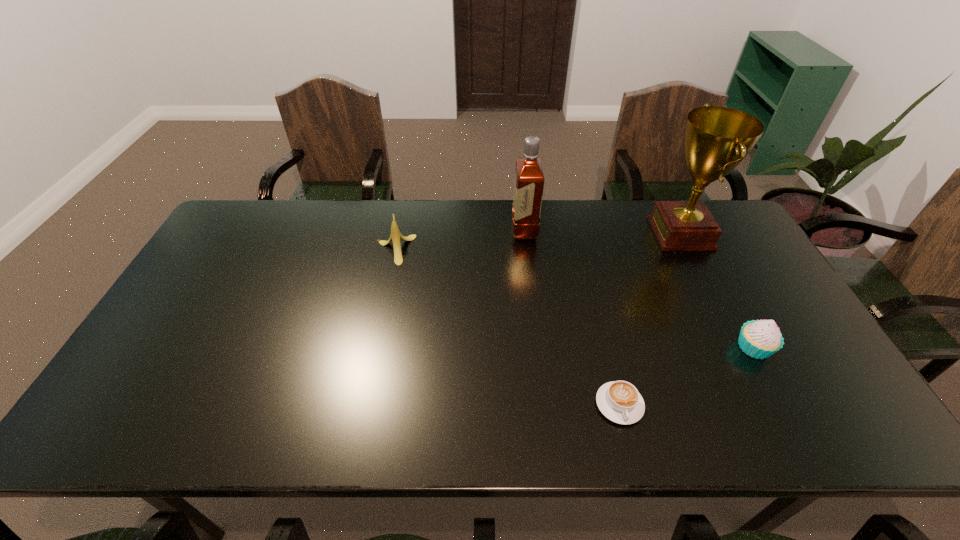
In order to click on blank region between the tallest object and the liquor in this screenshot , I will do `click(603, 231)`.

I want to click on empty location between the leftmost object and the award, so click(538, 241).

Find the location of a particular element. This screenshot has width=960, height=540. free area in between the award and the leftmost object is located at coordinates (538, 241).

Find the location of a particular element. Image resolution: width=960 pixels, height=540 pixels. unoccupied area between the tallest object and the fourth farthest object is located at coordinates (717, 290).

Locate an element on the screen. This screenshot has height=540, width=960. empty location between the nearest object and the leftmost object is located at coordinates [507, 327].

This screenshot has width=960, height=540. What are the coordinates of `free space between the leftmost object and the fourth object from right to left` in the screenshot? It's located at coord(460,240).

Where is `empty location between the fourth shortest object and the award`? empty location between the fourth shortest object and the award is located at coordinates tap(603, 231).

Choose which object is the second nearest neighbor to the tallest object. Please provide its 2D coordinates. Your answer should be formatted as a tuple, i.e. [(x, y)], where the tuple contains the x and y coordinates of a point satisfying the conditions above.

[(529, 179)]

Where is `object that stands as the second closest to the banana`? object that stands as the second closest to the banana is located at coordinates (619, 401).

I want to click on blank area in the image that satisfies the following two spatial constraints: 1. on the front label of the fourth shortest object; 2. on the right side of the cupcake, so click(x=538, y=347).